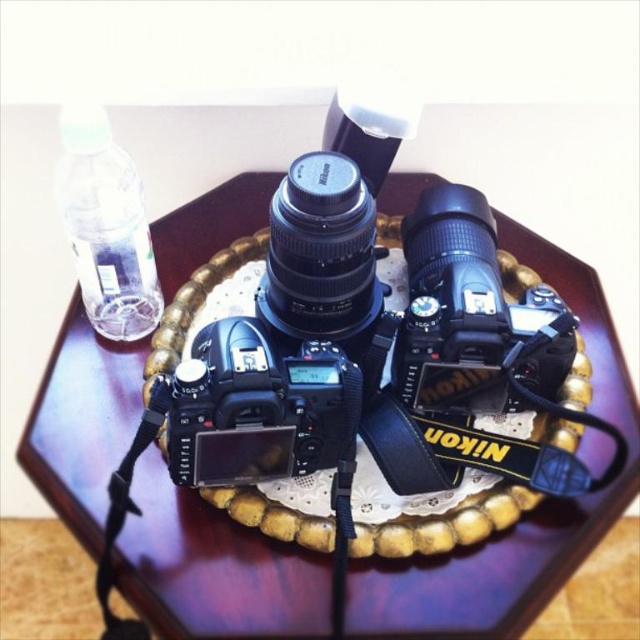
You are setting up a photography display and need to know if the wooden tray at center can be placed on top of the clear plastic bottle at upper left without it toppling over. Based on their heights, what do you think?

The wooden tray at center is taller than the clear plastic bottle at upper left, so placing the tray on top of the bottle may cause instability and likely result in the bottle toppling over due to the tray being taller and possibly heavier.

You are standing directly above the wooden hexagonal table. If you were to drop a coin from your current position, would it land closer to the black matte camera at center or the edge of the table?

The black matte camera at center is located at point (472, 316), which is very close to the center of the table. Dropping a coin from directly above would likely land it near the center, so the coin would land closer to the black matte camera at center than the edge of the table.

You are a photographer setting up equipment for a photoshoot. You need to place a new camera between the two points labeled point (492, 268) and point (97, 116). Which point should the camera be closer to in order to ensure it is positioned closer to the front of the scene?

The camera should be closer to point (97, 116) because it is closer to the front of the scene compared to point (492, 268) which is further back.